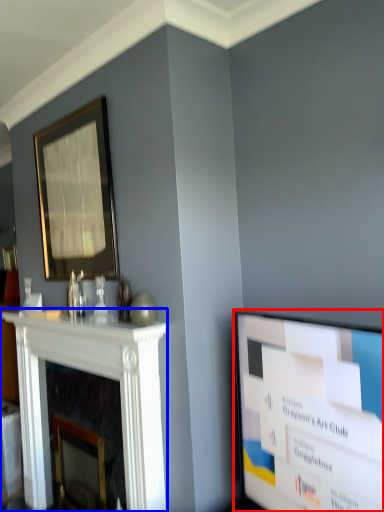
Question: Which point is closer to the camera, television (highlighted by a red box) or fireplace (highlighted by a blue box)?

Choices:
 (A) television
 (B) fireplace

Answer: (A)